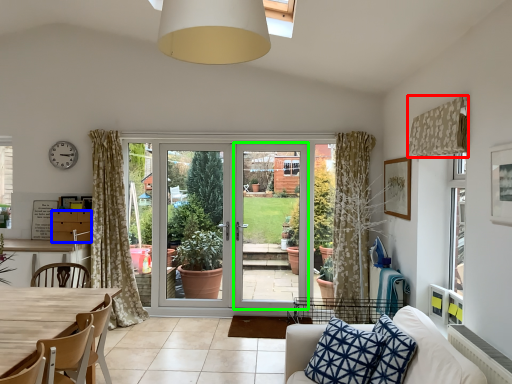
Question: Which is farther away from curtain (highlighted by a red box)? cabinetry (highlighted by a blue box) or screen door (highlighted by a green box)?

Choices:
 (A) cabinetry
 (B) screen door

Answer: (A)